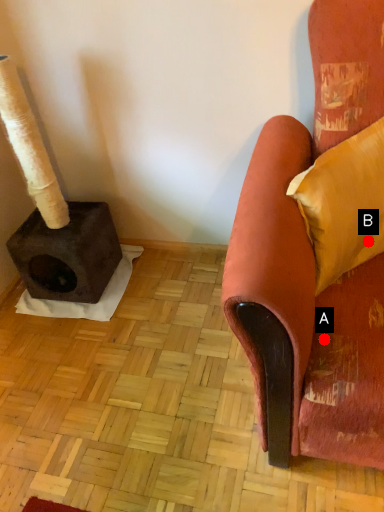
Question: Two points are circled on the image, labeled by A and B beside each circle. Which point is closer to the camera?

Choices:
 (A) A is closer
 (B) B is closer

Answer: (A)